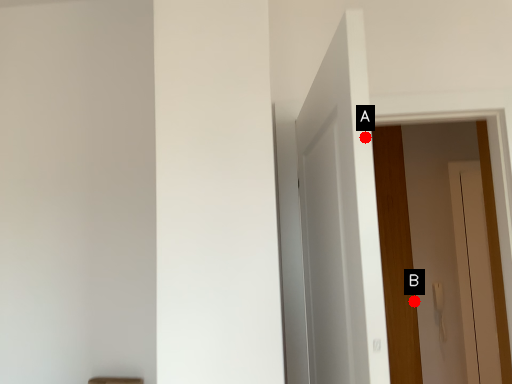
Question: Two points are circled on the image, labeled by A and B beside each circle. Which point is closer to the camera?

Choices:
 (A) A is closer
 (B) B is closer

Answer: (A)